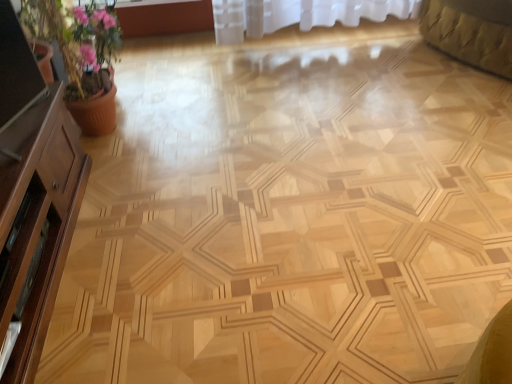
Question: From a real-world perspective, is brown wood dresser at left on matte wooden screen door at left?

Choices:
 (A) no
 (B) yes

Answer: (B)

Question: Is brown wood dresser at left turned away from matte wooden screen door at left?

Choices:
 (A) yes
 (B) no

Answer: (A)

Question: Is brown wood dresser at left at the right side of matte wooden screen door at left?

Choices:
 (A) no
 (B) yes

Answer: (A)

Question: Would you consider brown wood dresser at left to be distant from matte wooden screen door at left?

Choices:
 (A) yes
 (B) no

Answer: (B)

Question: Is brown wood dresser at left in front of matte wooden screen door at left?

Choices:
 (A) no
 (B) yes

Answer: (B)

Question: Does brown wood dresser at left have a larger size compared to matte wooden screen door at left?

Choices:
 (A) no
 (B) yes

Answer: (B)

Question: Does pink clay pot at left have a smaller size compared to matte wooden screen door at left?

Choices:
 (A) no
 (B) yes

Answer: (A)

Question: Is pink clay pot at left thinner than matte wooden screen door at left?

Choices:
 (A) yes
 (B) no

Answer: (B)

Question: Could you tell me if pink clay pot at left is facing matte wooden screen door at left?

Choices:
 (A) yes
 (B) no

Answer: (B)

Question: Is pink clay pot at left at the left side of matte wooden screen door at left?

Choices:
 (A) yes
 (B) no

Answer: (A)

Question: Considering the relative sizes of pink clay pot at left and matte wooden screen door at left in the image provided, is pink clay pot at left bigger than matte wooden screen door at left?

Choices:
 (A) yes
 (B) no

Answer: (A)

Question: Is pink clay pot at left wider than matte wooden screen door at left?

Choices:
 (A) no
 (B) yes

Answer: (B)

Question: From a real-world perspective, is pink clay pot at left under brown wood dresser at left?

Choices:
 (A) yes
 (B) no

Answer: (B)